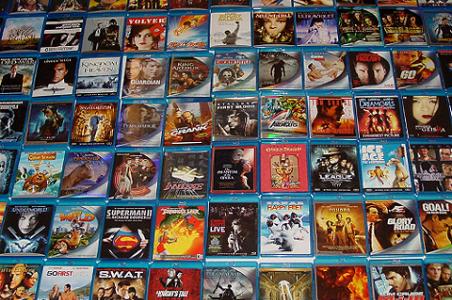
Where is `dvds in 2nd column from the left side`? dvds in 2nd column from the left side is located at coordinates (18, 285), (27, 233), (33, 171), (45, 122), (52, 86), (64, 36), (66, 5).